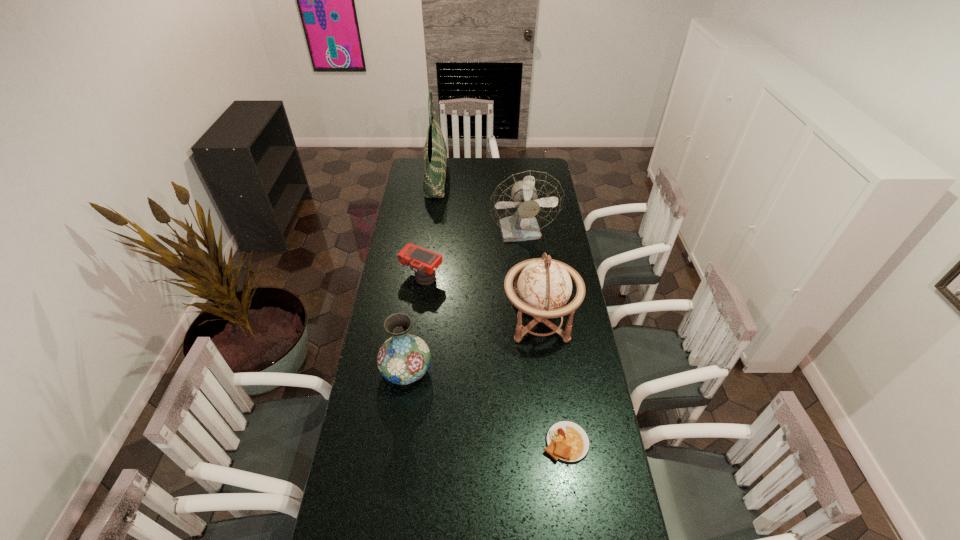
What are the coordinates of `the farthest object` in the screenshot? It's located at (435, 152).

In order to click on the tallest object in this screenshot , I will do `click(435, 152)`.

Locate an element on the screen. This screenshot has width=960, height=540. the fifth nearest object is located at coordinates (523, 204).

Find the location of a particular element. The image size is (960, 540). globe is located at coordinates (544, 286).

Locate an element on the screen. The image size is (960, 540). the third shortest object is located at coordinates 404,358.

At what (x,y) coordinates should I click in order to perform the action: click on the fourth nearest object. Please return your answer as a coordinate pair (x, y). This screenshot has width=960, height=540. Looking at the image, I should click on (423, 262).

This screenshot has height=540, width=960. What are the coordinates of `camera` in the screenshot? It's located at (423, 262).

This screenshot has height=540, width=960. Identify the location of the shortest object. (566, 441).

The image size is (960, 540). Identify the location of omelet. (566, 441).

This screenshot has height=540, width=960. I want to click on free point located on the left of the tallest object, so click(x=414, y=179).